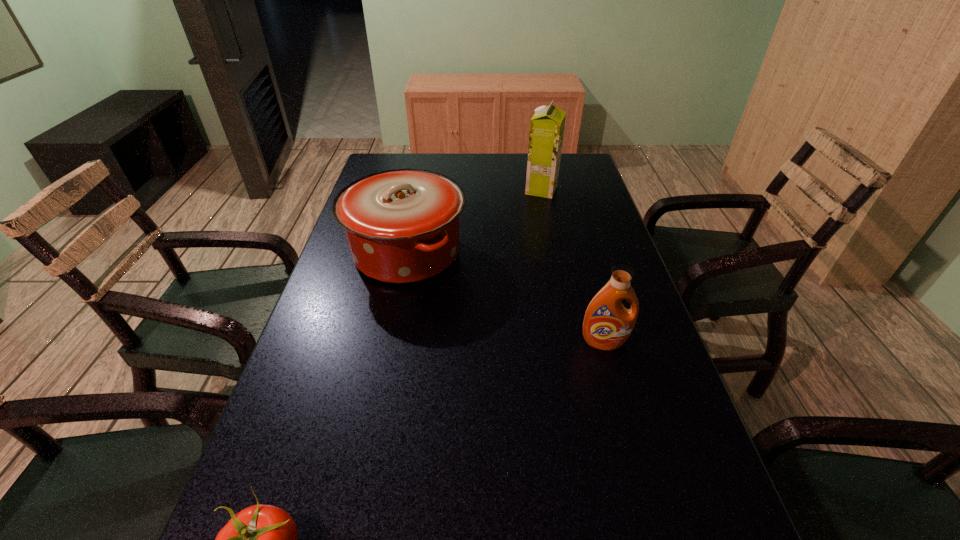
Locate an element on the screen. detergent that is at the right edge is located at coordinates [x=607, y=324].

Find the location of a particular element. object at the far right corner is located at coordinates (547, 125).

In order to click on free space at the far edge in this screenshot , I will do `click(501, 185)`.

Image resolution: width=960 pixels, height=540 pixels. Identify the location of free location at the left edge of the desktop. (349, 315).

Locate an element on the screen. vacant area at the right edge of the desktop is located at coordinates (578, 198).

The width and height of the screenshot is (960, 540). Find the location of `vacant region at the far left corner of the desktop`. vacant region at the far left corner of the desktop is located at coordinates (409, 167).

I want to click on free region at the far right corner of the desktop, so click(574, 164).

Identify the location of vacant space in between the soya milk and the detergent. (573, 266).

Image resolution: width=960 pixels, height=540 pixels. Find the location of `free space that is in between the farthest object and the third nearest object`. free space that is in between the farthest object and the third nearest object is located at coordinates (474, 221).

You are a GUI agent. You are given a task and a screenshot of the screen. Output one action in this format:
    pyautogui.click(x=<x>, y=<y>)
    Task: Click on the free spot between the farthest object and the detergent
    
    Given the screenshot: What is the action you would take?
    pyautogui.click(x=573, y=266)